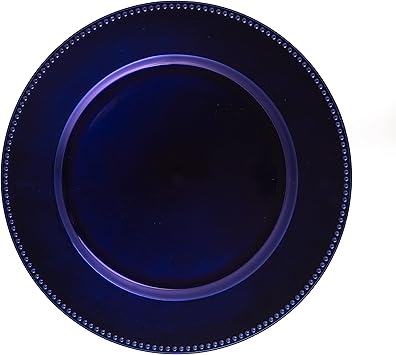
At what (x,y) coordinates should I click in order to perform the action: click on westernmost portion of charger plate. Please return your answer as a coordinate pair (x, y). This screenshot has width=396, height=355. Looking at the image, I should click on (1, 174).